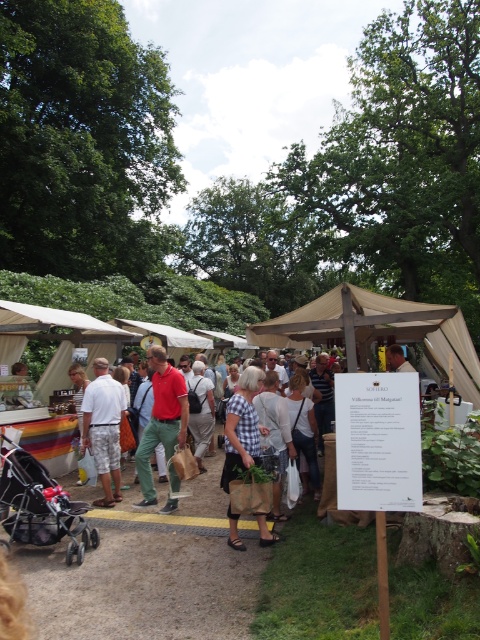
Question: Considering the real-world distances, which object is farthest from the checkered fabric dress at center?

Choices:
 (A) matte red polo shirt at center
 (B) green cotton pants at center

Answer: (A)

Question: Considering the real-world distances, which object is closest to the white cotton shorts at center?

Choices:
 (A) checkered fabric dress at center
 (B) brown paper bag at center
 (C) matte red polo shirt at center
 (D) green cotton pants at center

Answer: (D)

Question: Considering the relative positions of green cotton pants at center and checkered fabric dress at center in the image provided, where is green cotton pants at center located with respect to checkered fabric dress at center?

Choices:
 (A) left
 (B) right

Answer: (A)

Question: Does matte red polo shirt at center come behind checkered fabric dress at center?

Choices:
 (A) no
 (B) yes

Answer: (B)

Question: Which of the following is the closest to the observer?

Choices:
 (A) (264, 600)
 (B) (106, 436)
 (C) (96, 369)

Answer: (A)

Question: Is the position of brown paper bag at center less distant than that of matte red polo shirt at center?

Choices:
 (A) yes
 (B) no

Answer: (A)